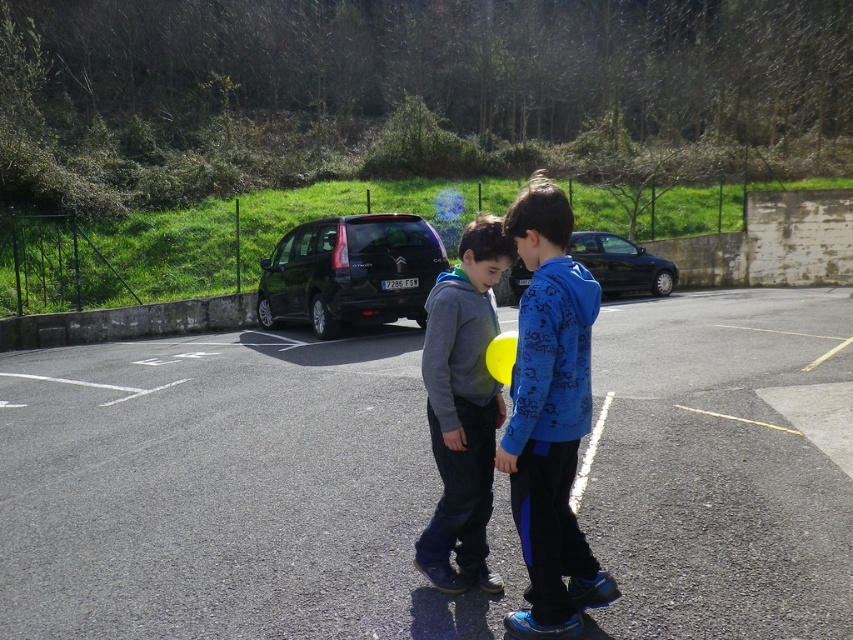
Question: Which object is positioned closest to the gray fleece hoodie at center?

Choices:
 (A) asphalt at center
 (B) shiny black car at center
 (C) black matte van at center

Answer: (A)

Question: Which object is farther from the camera taking this photo?

Choices:
 (A) shiny black car at center
 (B) gray fleece hoodie at center

Answer: (A)

Question: Does blue fleece jacket at center appear on the right side of black matte van at center?

Choices:
 (A) yes
 (B) no

Answer: (A)

Question: Can you confirm if asphalt at center is smaller than gray fleece hoodie at center?

Choices:
 (A) yes
 (B) no

Answer: (B)

Question: Is black matte van at center thinner than shiny black car at center?

Choices:
 (A) no
 (B) yes

Answer: (A)

Question: Which point is closer to the camera?

Choices:
 (A) asphalt at center
 (B) gray fleece hoodie at center

Answer: (A)